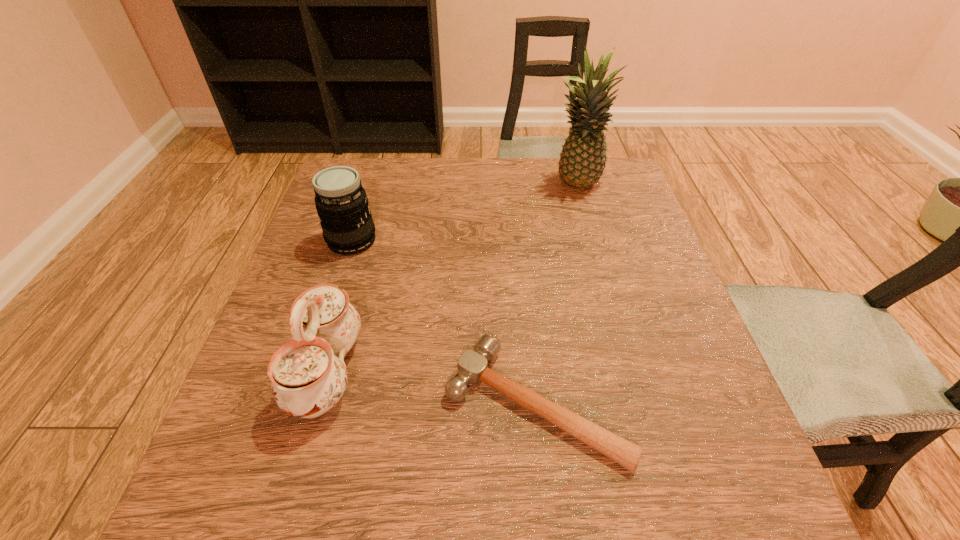
Find the location of `blank region between the hammer and the third nearest object`. blank region between the hammer and the third nearest object is located at coordinates (444, 322).

Locate an element on the screen. This screenshot has height=540, width=960. free point between the shortest object and the pineapple is located at coordinates (555, 293).

In order to click on free point between the telephoto lens and the tallest object in this screenshot , I will do `click(463, 212)`.

Identify the location of the third closest object to the hammer. (582, 161).

Image resolution: width=960 pixels, height=540 pixels. I want to click on object that stands as the third closest to the chinaware, so click(x=582, y=161).

Where is `free space that satisfies the following two spatial constraints: 1. by the handle of the hammer; 2. on the right side of the chinaware`? Image resolution: width=960 pixels, height=540 pixels. free space that satisfies the following two spatial constraints: 1. by the handle of the hammer; 2. on the right side of the chinaware is located at coordinates (318, 402).

Where is `vacant area that satisfies the following two spatial constraints: 1. by the handle of the hammer; 2. on the right side of the chinaware`? The width and height of the screenshot is (960, 540). vacant area that satisfies the following two spatial constraints: 1. by the handle of the hammer; 2. on the right side of the chinaware is located at coordinates (318, 402).

This screenshot has width=960, height=540. I want to click on vacant point that satisfies the following two spatial constraints: 1. on the back side of the telephoto lens; 2. on the left side of the pineapple, so click(x=370, y=184).